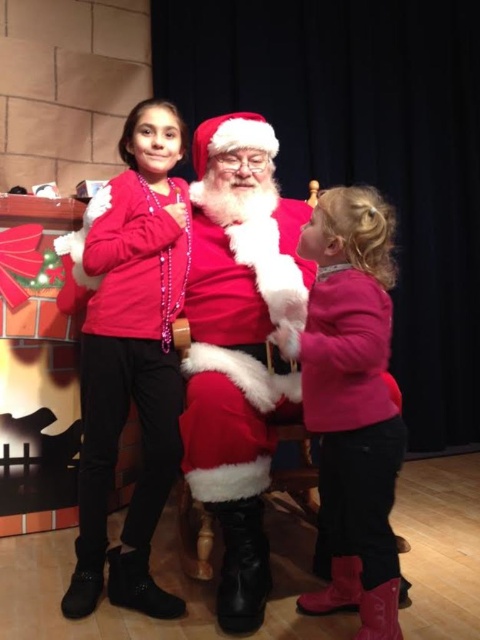
Question: Among these objects, which one is farthest from the camera?

Choices:
 (A) fuzzy red santa at center
 (B) matte red sweater at left
 (C) pink fuzzy sweater at right
 (D) velvet red santa suit at center

Answer: (B)

Question: Which of these objects is positioned farthest from the pink fuzzy sweater at right?

Choices:
 (A) velvet red santa suit at center
 (B) matte red sweater at left

Answer: (B)

Question: Can you confirm if matte red sweater at left is positioned to the right of velvet red santa suit at center?

Choices:
 (A) yes
 (B) no

Answer: (B)

Question: Does fuzzy red santa at center come behind velvet red santa suit at center?

Choices:
 (A) no
 (B) yes

Answer: (A)

Question: Does matte red sweater at left have a lesser width compared to velvet red santa suit at center?

Choices:
 (A) yes
 (B) no

Answer: (B)

Question: Estimate the real-world distances between objects in this image. Which object is closer to the matte red sweater at left?

Choices:
 (A) pink fuzzy sweater at right
 (B) fuzzy red santa at center
 (C) velvet red santa suit at center

Answer: (B)